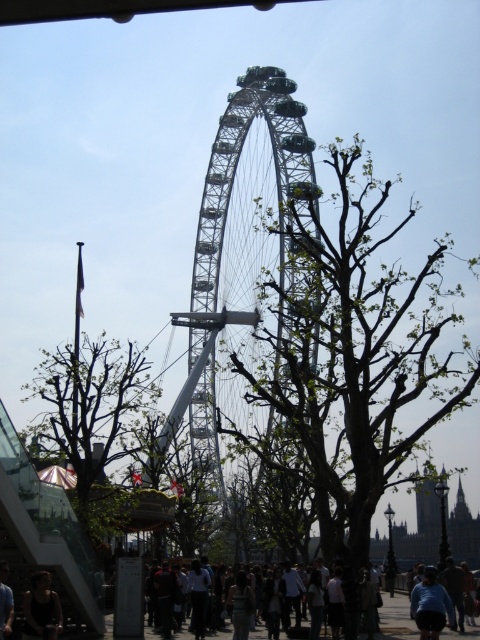
You are a tourist visiting the London Eye and want to take a photo that includes both the green leafy tree at left and the blue denim jeans at lower right. Which object should you focus on first to ensure both are in frame?

You should focus on the green leafy tree at left first because it is larger in size than the blue denim jeans at lower right, so it will require more space in the frame.

You are standing at the center of the London Eye area and want to take a photo of the blue denim jeans at lower right. Which direction should you face to ensure the London Eye Ferris wheel is partially visible in the background?

The blue denim jeans at lower right is located at point [430,605], so you should face towards the lower right direction to capture the London Eye Ferris wheel partially in the background.